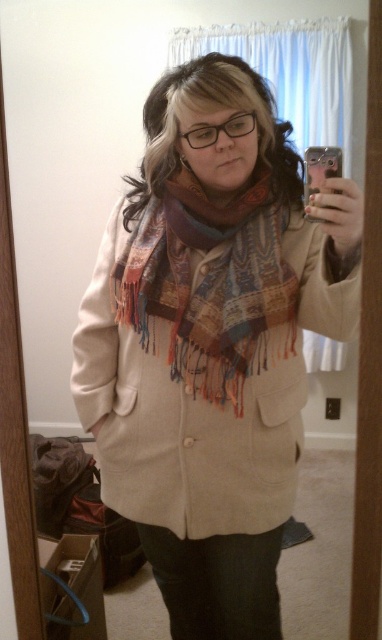
You are trying to locate the multicolored woven scarf at center in the bedroom scene. According to the coordinates provided, where exactly is it positioned?

The multicolored woven scarf at center is located at point coordinates of (210, 284).

You are standing in a bedroom and see a person taking a mirror selfie. The person is wearing a beige coat and has a colorful scarf around their neck. There is a point at coordinates (212, 342) in the image. What object is located at that point?

The object at point (212, 342) is the paisley scarf at center.